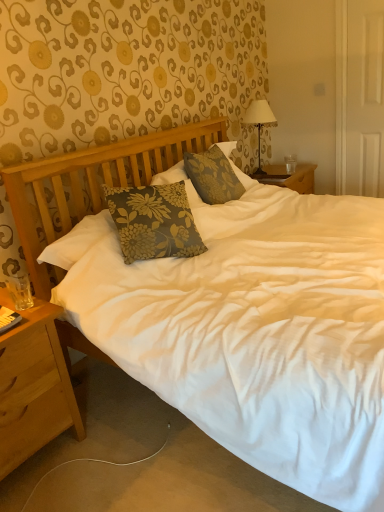
Question: Considering the relative sizes of clear glass coffee cup at right and light brown wood nightstand at lower left in the image provided, is clear glass coffee cup at right smaller than light brown wood nightstand at lower left?

Choices:
 (A) no
 (B) yes

Answer: (B)

Question: Is light brown wood nightstand at lower left completely or partially inside clear glass coffee cup at right?

Choices:
 (A) yes
 (B) no

Answer: (B)

Question: From a real-world perspective, does clear glass coffee cup at right sit lower than light brown wood nightstand at lower left?

Choices:
 (A) yes
 (B) no

Answer: (B)

Question: Can we say clear glass coffee cup at right lies outside light brown wood nightstand at lower left?

Choices:
 (A) no
 (B) yes

Answer: (B)

Question: From the image's perspective, is clear glass coffee cup at right under light brown wood nightstand at lower left?

Choices:
 (A) no
 (B) yes

Answer: (A)

Question: From their relative heights in the image, would you say white fabric-covered lamp at upper right is taller or shorter than light brown wood nightstand at lower left?

Choices:
 (A) tall
 (B) short

Answer: (B)

Question: In the image, is white fabric-covered lamp at upper right positioned in front of or behind light brown wood nightstand at lower left?

Choices:
 (A) behind
 (B) front

Answer: (A)

Question: Based on their sizes in the image, would you say white fabric-covered lamp at upper right is bigger or smaller than light brown wood nightstand at lower left?

Choices:
 (A) small
 (B) big

Answer: (A)

Question: Considering the positions of white fabric-covered lamp at upper right and light brown wood nightstand at lower left in the image, is white fabric-covered lamp at upper right wider or thinner than light brown wood nightstand at lower left?

Choices:
 (A) thin
 (B) wide

Answer: (A)

Question: Is light brown wood nightstand at lower left situated inside white fabric-covered lamp at upper right or outside?

Choices:
 (A) outside
 (B) inside

Answer: (A)

Question: Based on their sizes in the image, would you say light brown wood nightstand at lower left is bigger or smaller than white fabric-covered lamp at upper right?

Choices:
 (A) small
 (B) big

Answer: (B)

Question: Would you say light brown wood nightstand at lower left is to the left or to the right of white fabric-covered lamp at upper right in the picture?

Choices:
 (A) left
 (B) right

Answer: (A)

Question: From the image's perspective, is light brown wood nightstand at lower left located above or below white fabric-covered lamp at upper right?

Choices:
 (A) above
 (B) below

Answer: (B)

Question: In the image, is light brown wood nightstand at lower left positioned in front of or behind clear glass coffee cup at right?

Choices:
 (A) behind
 (B) front

Answer: (B)

Question: Is light brown wood nightstand at lower left to the left or to the right of clear glass coffee cup at right in the image?

Choices:
 (A) left
 (B) right

Answer: (A)